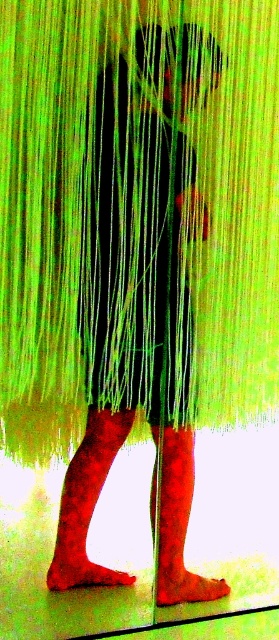
Question: Considering the relative positions of velvet red sock at lower left and matte red sock at lower center in the image provided, where is velvet red sock at lower left located with respect to matte red sock at lower center?

Choices:
 (A) right
 (B) left

Answer: (B)

Question: Which of the following is the farthest from the observer?

Choices:
 (A) (46, 205)
 (B) (184, 525)
 (C) (70, 556)

Answer: (B)

Question: Considering the relative positions of velvet red sock at lower left and matte red sock at lower center in the image provided, where is velvet red sock at lower left located with respect to matte red sock at lower center?

Choices:
 (A) above
 (B) below

Answer: (A)

Question: Which of the following is the closest to the observer?

Choices:
 (A) velvet red sock at lower left
 (B) green string curtain at center
 (C) matte red sock at lower center

Answer: (B)

Question: Does green string curtain at center appear on the right side of velvet red sock at lower left?

Choices:
 (A) yes
 (B) no

Answer: (A)

Question: Which is farther from the matte red sock at lower center?

Choices:
 (A) velvet red sock at lower left
 (B) green string curtain at center

Answer: (B)